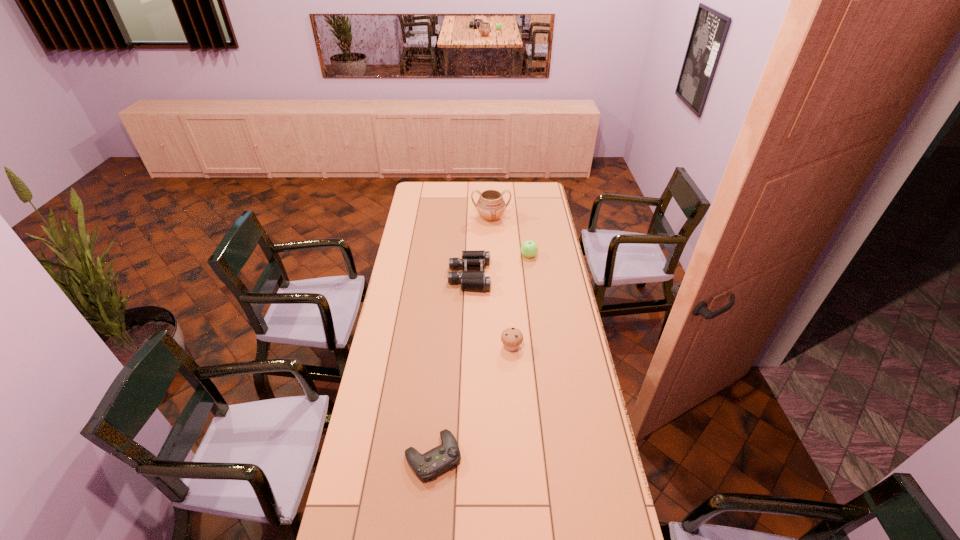
The height and width of the screenshot is (540, 960). Find the location of `urn`. urn is located at coordinates (490, 205).

The image size is (960, 540). I want to click on the farthest object, so click(x=490, y=205).

Find the location of a particular element. The width and height of the screenshot is (960, 540). binoculars is located at coordinates (470, 280).

Identify the location of apple. (529, 248).

The image size is (960, 540). I want to click on the fourth farthest object, so click(512, 337).

Identify the location of the shortest object. Image resolution: width=960 pixels, height=540 pixels. (439, 459).

This screenshot has width=960, height=540. What are the coordinates of `control` in the screenshot? It's located at (439, 459).

The height and width of the screenshot is (540, 960). What are the coordinates of `vacant position located on the front-facing side of the farthest object` in the screenshot? It's located at (492, 261).

You are a GUI agent. You are given a task and a screenshot of the screen. Output one action in this format:
    pyautogui.click(x=<x>, y=<y>)
    Task: Click on the vacant space located on the front-facing side of the binoculars
    This screenshot has height=540, width=960.
    Given the screenshot: What is the action you would take?
    pyautogui.click(x=544, y=276)

Find the location of a particular element. This screenshot has width=960, height=540. vacant position located on the back of the apple is located at coordinates (524, 225).